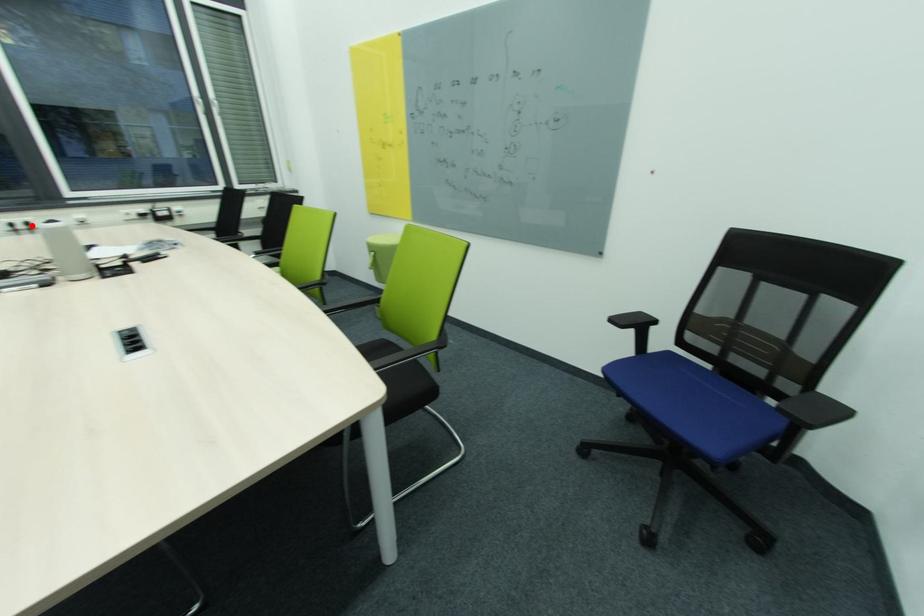
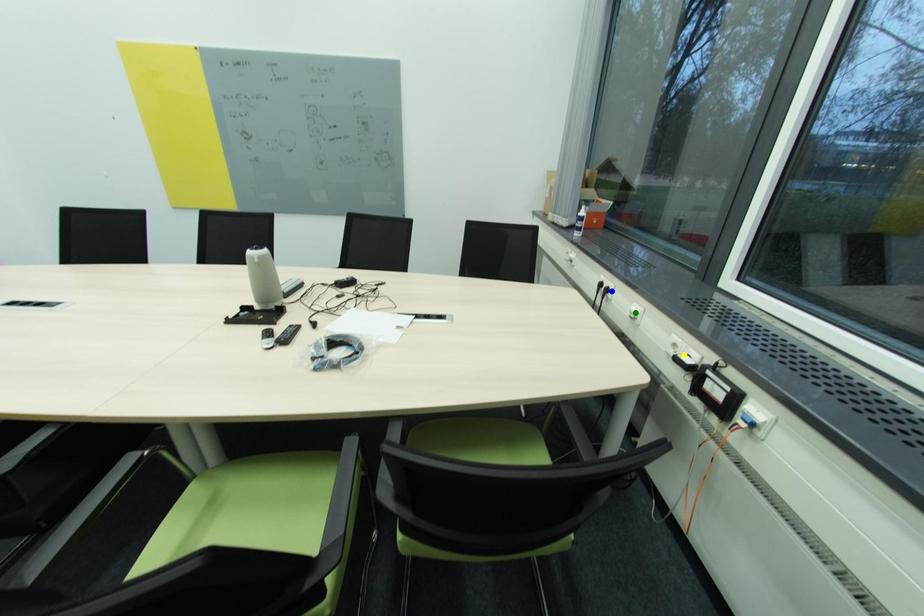
Question: I am providing you with two images of the same scene from different viewpoints. A red point is marked on the first image. You are given multiple points on the second image. Which mark in image 2 goes with the point in image 1?

Choices:
 (A) yellow point
 (B) green point
 (C) blue point

Answer: (C)